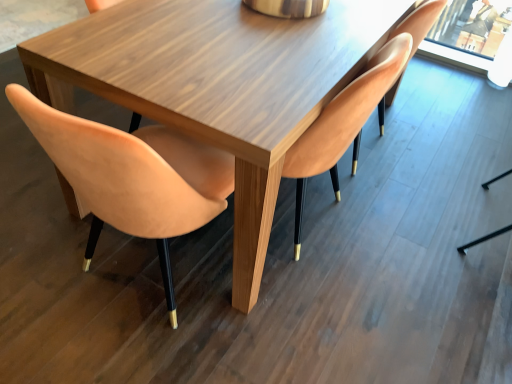
Locate an element on the screen. The image size is (512, 384). vacant space in front of matte wood chair at center, the 2th chair positioned from the left is located at coordinates (296, 326).